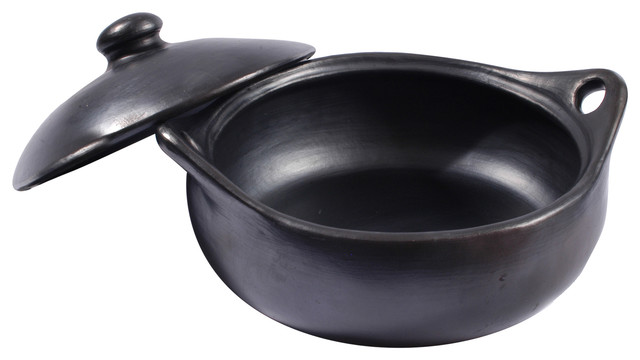
Image resolution: width=640 pixels, height=360 pixels. In order to click on pot handles in this screenshot , I will do pyautogui.click(x=171, y=147), pyautogui.click(x=612, y=81).